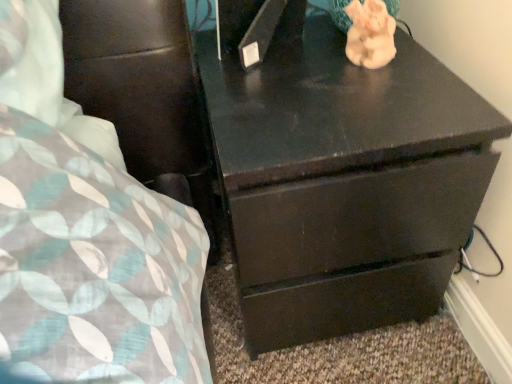
Find the location of a particular element. This screenshot has width=512, height=384. free spot to the left of porcelain pink elephant at upper right is located at coordinates (284, 85).